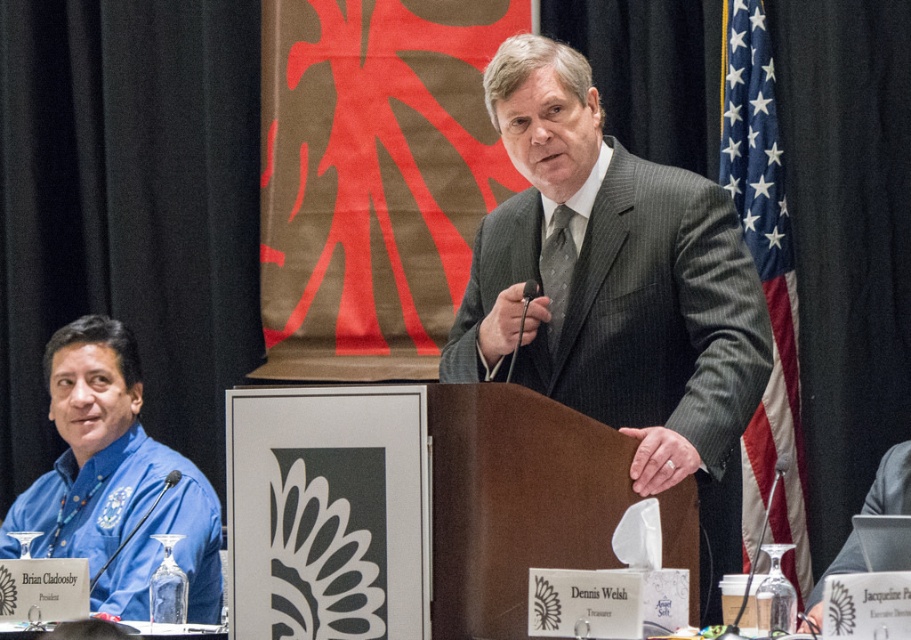
You are attending a formal event and notice the blue fabric shirt at left and the american flag at right. Which object is shorter in height?

The blue fabric shirt at left has a lesser height compared to the american flag at right, so the blue fabric shirt at left is shorter in height.

You are standing at the back of the room facing the podium. There are two points marked on the screen. The first point is at coordinate point(120, 490) and the second is at point(805, 545). Which point is closer to you?

Point(120, 490) is in front of point(805, 545), so the second point at point(805, 545) is closer to you.

Consider the image. You are a photographer standing at the back of the room. You want to take a photo of the speaker so that both the american flag at right and the pinstriped fabric tie at center are clearly visible in the frame. Given that your camera has a maximum focus range of 3.5 feet, will you be able to capture both objects in focus?

The american flag at right is 4.03 feet away from the pinstriped fabric tie at center. Since the distance between them exceeds the camera focus range of 3.5 feet, you cannot capture both in focus simultaneously.